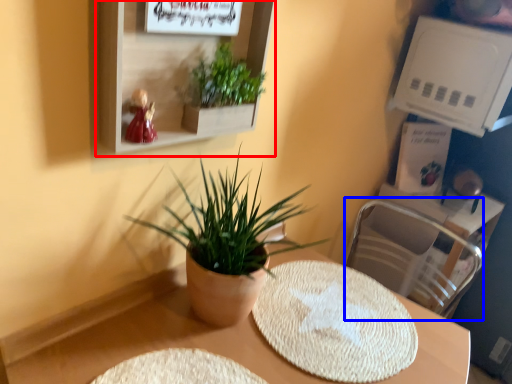
Question: Among these objects, which one is farthest to the camera, shelf (highlighted by a red box) or swivel chair (highlighted by a blue box)?

Choices:
 (A) shelf
 (B) swivel chair

Answer: (B)